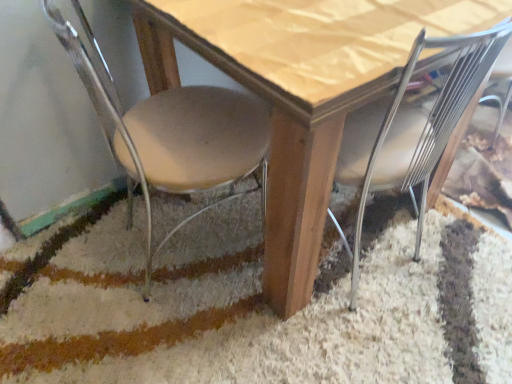
Question: Does beige fabric chair at lower left, acting as the second chair starting from the right, appear on the left side of metallic silver chair at lower right, positioned as the first chair in right-to-left order?

Choices:
 (A) yes
 (B) no

Answer: (A)

Question: Considering the relative sizes of beige fabric chair at lower left, acting as the second chair starting from the right, and metallic silver chair at lower right, positioned as the first chair in right-to-left order, in the image provided, is beige fabric chair at lower left, acting as the second chair starting from the right, taller than metallic silver chair at lower right, positioned as the first chair in right-to-left order,?

Choices:
 (A) no
 (B) yes

Answer: (A)

Question: From a real-world perspective, is beige fabric chair at lower left, the 1th chair in the left-to-right sequence, located beneath metallic silver chair at lower right, the second chair when ordered from left to right?

Choices:
 (A) yes
 (B) no

Answer: (A)

Question: Is beige fabric chair at lower left, the 1th chair in the left-to-right sequence, positioned before metallic silver chair at lower right, positioned as the first chair in right-to-left order?

Choices:
 (A) no
 (B) yes

Answer: (B)

Question: Is beige fabric chair at lower left, the 1th chair in the left-to-right sequence, bigger than metallic silver chair at lower right, the second chair when ordered from left to right?

Choices:
 (A) no
 (B) yes

Answer: (B)

Question: From the image's perspective, does beige fabric chair at lower left, acting as the second chair starting from the right, appear lower than metallic silver chair at lower right, the second chair when ordered from left to right?

Choices:
 (A) yes
 (B) no

Answer: (B)

Question: From a real-world perspective, is beige fabric chair at lower left, acting as the second chair starting from the right, positioned over wooden table at center based on gravity?

Choices:
 (A) yes
 (B) no

Answer: (A)

Question: From a real-world perspective, is beige fabric chair at lower left, acting as the second chair starting from the right, below wooden table at center?

Choices:
 (A) no
 (B) yes

Answer: (A)

Question: Does beige fabric chair at lower left, acting as the second chair starting from the right, have a lesser height compared to wooden table at center?

Choices:
 (A) no
 (B) yes

Answer: (A)

Question: Is beige fabric chair at lower left, the 1th chair in the left-to-right sequence, smaller than wooden table at center?

Choices:
 (A) no
 (B) yes

Answer: (B)

Question: Is beige fabric chair at lower left, the 1th chair in the left-to-right sequence, looking in the opposite direction of wooden table at center?

Choices:
 (A) no
 (B) yes

Answer: (B)

Question: Does beige fabric chair at lower left, the 1th chair in the left-to-right sequence, appear on the right side of wooden table at center?

Choices:
 (A) no
 (B) yes

Answer: (A)

Question: Is metallic silver chair at lower right, positioned as the first chair in right-to-left order, outside wooden table at center?

Choices:
 (A) no
 (B) yes

Answer: (A)